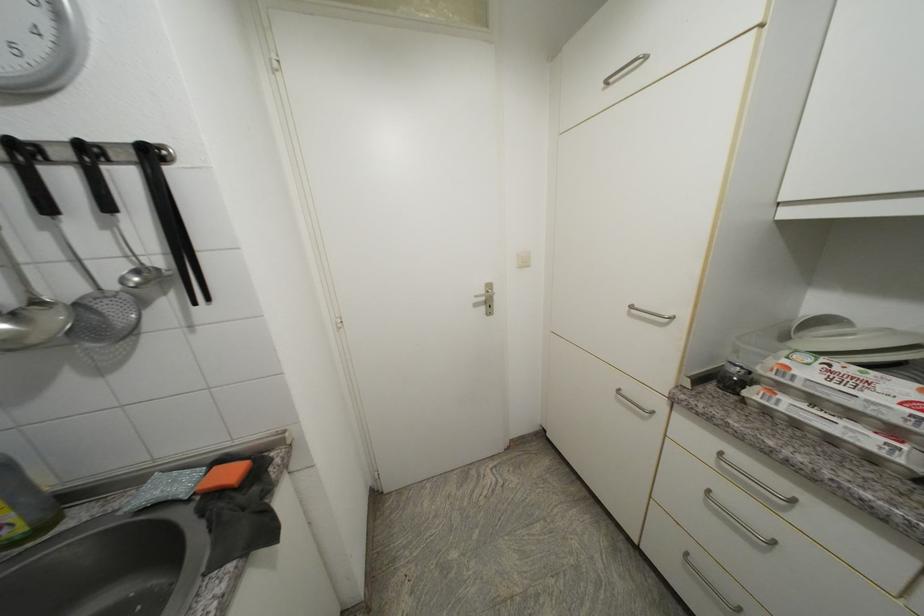
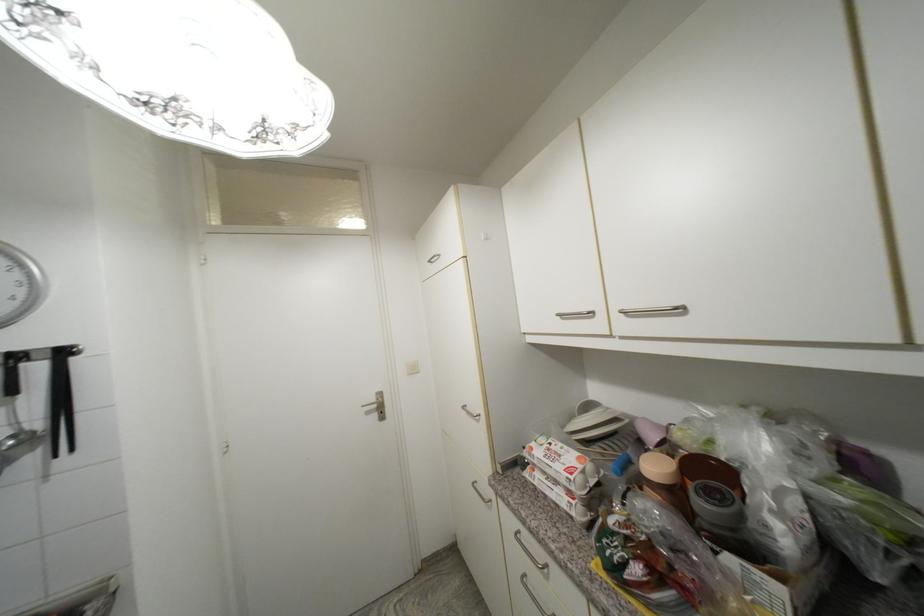
The point at (489, 293) is marked in the first image. Where is the corresponding point in the second image?

(380, 400)